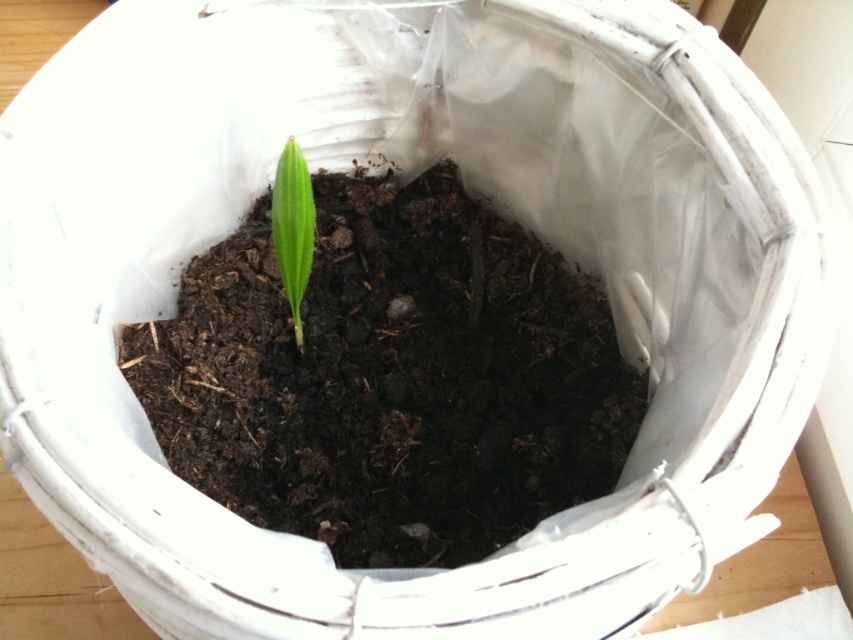
You are a gardener looking at the plant in the white bucket. You notice the dark brown soil at center and the green matte leaf at center. Which object is positioned to the right of the other?

The dark brown soil at center is to the right of the green matte leaf at center.

You are a gardener who wants to transplant the green matte leaf at center into a new pot. Since the dark brown soil at center is currently holding it, can you tell me which one is bigger in size?

The dark brown soil at center is larger in size than green matte leaf at center, so the soil is bigger and can hold the leaf properly.

You are a gardener trying to locate the dark brown soil at center in the image. According to the coordinates provided, where exactly is it positioned?

The dark brown soil at center is precisely located at the coordinates point (390, 378).